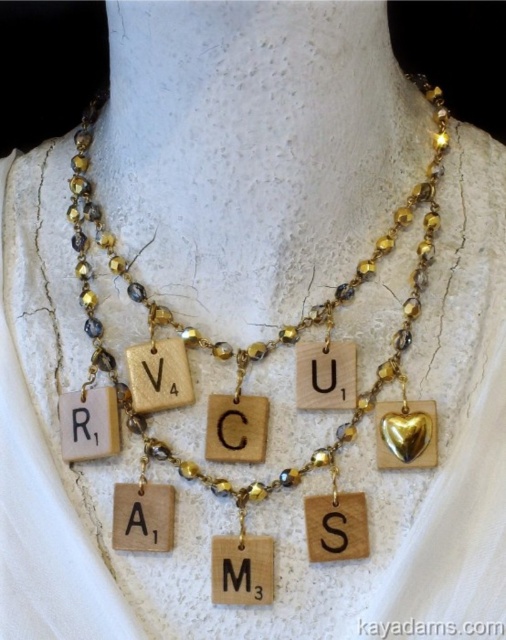
You are an appraiser examining the necklace. You need to determine which object is taller between the wooden scrabble tiles at center and the matte gold letter m at center. Which one is taller?

The wooden scrabble tiles at center has a greater height compared to the matte gold letter m at center, so the wooden scrabble tiles at center is taller.

You are an appraiser examining the necklace. You notice two wooden elements at the center of the necklace. Which one is closer to you, the wooden scrabble tiles at center or the wooden letter at center?

The wooden scrabble tiles at center is closer to the viewer than the wooden letter at center.